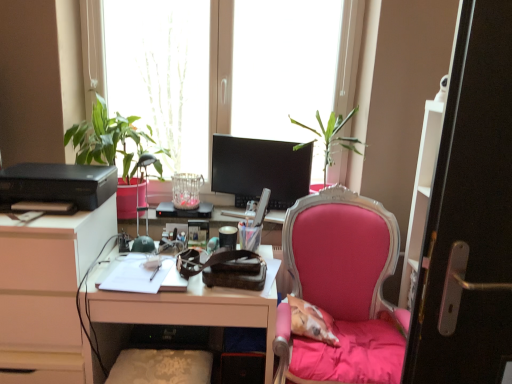
Image resolution: width=512 pixels, height=384 pixels. What do you see at coordinates (47, 292) in the screenshot?
I see `white matte cabinet at left` at bounding box center [47, 292].

You are a GUI agent. You are given a task and a screenshot of the screen. Output one action in this format:
    pyautogui.click(x=<x>, y=<y>)
    Task: Click on the white glossy desk at center
    
    Given the screenshot: What is the action you would take?
    pyautogui.click(x=181, y=312)

Where is `pink fabric chair at center`? The image size is (512, 384). pink fabric chair at center is located at coordinates (345, 287).

I want to click on green matte plant at upper left, so click(x=111, y=140).

From the image's perspective, is transparent glass window at upper center below black matte printer at left?

Incorrect, from the image's perspective, transparent glass window at upper center is higher than black matte printer at left.

Is transparent glass window at upper center closer to the viewer compared to black matte printer at left?

No.

Is transparent glass window at upper center to the left of black matte printer at left from the viewer's perspective?

No.

Is matte black monitor at center looking in the opposite direction of white matte cabinet at left?

matte black monitor at center does not have its back to white matte cabinet at left.

Is matte black monitor at center in contact with white matte cabinet at left?

No, matte black monitor at center is not making contact with white matte cabinet at left.

Consider the image. From a real-world perspective, relative to white matte cabinet at left, is matte black monitor at center vertically above or below?

matte black monitor at center is above white matte cabinet at left.

Who is taller, matte black monitor at center or white matte cabinet at left?

white matte cabinet at left is taller.

From the image's perspective, is green matte lamp at left over matte black monitor at center?

Incorrect, from the image's perspective, green matte lamp at left is lower than matte black monitor at center.

How much distance is there between green matte lamp at left and matte black monitor at center?

Result: A distance of 20.31 inches exists between green matte lamp at left and matte black monitor at center.

Is green matte lamp at left taller or shorter than matte black monitor at center?

Clearly, green matte lamp at left is taller compared to matte black monitor at center.

Is green matte lamp at left beside matte black monitor at center?

No, green matte lamp at left is not in contact with matte black monitor at center.

Looking at this image, is green matte plant at upper left turned away from transparent glass window at upper center?

Yes, transparent glass window at upper center is at the back of green matte plant at upper left.

In terms of width, does green matte plant at upper left look wider or thinner when compared to transparent glass window at upper center?

Clearly, green matte plant at upper left has more width compared to transparent glass window at upper center.

Is green matte plant at upper left bigger than transparent glass window at upper center?

No, green matte plant at upper left is not bigger than transparent glass window at upper center.

Does point (267, 140) appear closer or farther from the camera than point (124, 213)?

Point (267, 140) is farther from the camera than point (124, 213).

Does matte black monitor at center lie behind green matte plant at upper left?

Yes.

Is matte black monitor at center to the left or to the right of green matte plant at upper left in the image?

Based on their positions, matte black monitor at center is located to the right of green matte plant at upper left.

Between green matte plant at upper left and white matte cabinet at left, which one is positioned in front?

white matte cabinet at left is closer to the camera.

Consider the image. Is green matte plant at upper left bigger than white matte cabinet at left?

Correct, green matte plant at upper left is larger in size than white matte cabinet at left.

Based on the photo, from the image's perspective, which object appears higher, green matte plant at upper left or white matte cabinet at left?

From the image's view, green matte plant at upper left is above.

Which of these two, white matte cabinet at left or pink fabric chair at center, is thinner?

Thinner between the two is white matte cabinet at left.

From a real-world perspective, is white matte cabinet at left positioned above or below pink fabric chair at center?

From a real-world perspective, white matte cabinet at left is physically above pink fabric chair at center.

Which is more to the right, white matte cabinet at left or pink fabric chair at center?

pink fabric chair at center.

The image size is (512, 384). What are the coordinates of `chair below the white matte cabinet at left (from a real-world perspective)` in the screenshot? It's located at (345, 287).

Where is `window on the right of black matte printer at left`? window on the right of black matte printer at left is located at coordinates (225, 68).

At what (x,y) coordinates should I click in order to perform the action: click on television behind the white matte cabinet at left. Please return your answer as a coordinate pair (x, y). The width and height of the screenshot is (512, 384). Looking at the image, I should click on (260, 170).

Considering their positions, is white glossy desk at center positioned closer to matte black monitor at center than transparent glass window at upper center?

The object closer to matte black monitor at center is transparent glass window at upper center.

When comparing their distances from transparent glass window at upper center, does green matte lamp at left or black matte printer at left seem further?

black matte printer at left is further to transparent glass window at upper center.

Considering their positions, is green matte lamp at left positioned further to white glossy desk at center than white matte cabinet at left?

green matte lamp at left is positioned further to the anchor white glossy desk at center.

Considering their positions, is pink fabric chair at center positioned closer to transparent glass window at upper center than green matte lamp at left?

The object closer to transparent glass window at upper center is green matte lamp at left.

When comparing their distances from green matte lamp at left, does green matte plant at upper left or pink fabric chair at center seem further?

Based on the image, pink fabric chair at center appears to be further to green matte lamp at left.

Based on their spatial positions, is green matte lamp at left or white matte cabinet at left closer to matte black monitor at center?

green matte lamp at left lies closer to matte black monitor at center than the other object.

Considering their positions, is white matte cabinet at left positioned further to white glossy desk at center than transparent glass window at upper center?

Based on the image, transparent glass window at upper center appears to be further to white glossy desk at center.

Considering their positions, is matte black monitor at center positioned further to pink fabric chair at center than transparent glass window at upper center?

transparent glass window at upper center lies further to pink fabric chair at center than the other object.

You are a GUI agent. You are given a task and a screenshot of the screen. Output one action in this format:
    pyautogui.click(x=<x>, y=<y>)
    Task: Click on the television between green matte lamp at left and pink fabric chair at center
    This screenshot has width=512, height=384.
    Given the screenshot: What is the action you would take?
    pos(260,170)

This screenshot has height=384, width=512. I want to click on television between transparent glass window at upper center and green matte lamp at left in the vertical direction, so click(x=260, y=170).

Locate an element on the screen. The width and height of the screenshot is (512, 384). lamp located between black matte printer at left and transparent glass window at upper center in the left-right direction is located at coordinates (145, 185).

Identify the location of houseplant between black matte printer at left and matte black monitor at center. The height and width of the screenshot is (384, 512). (111, 140).